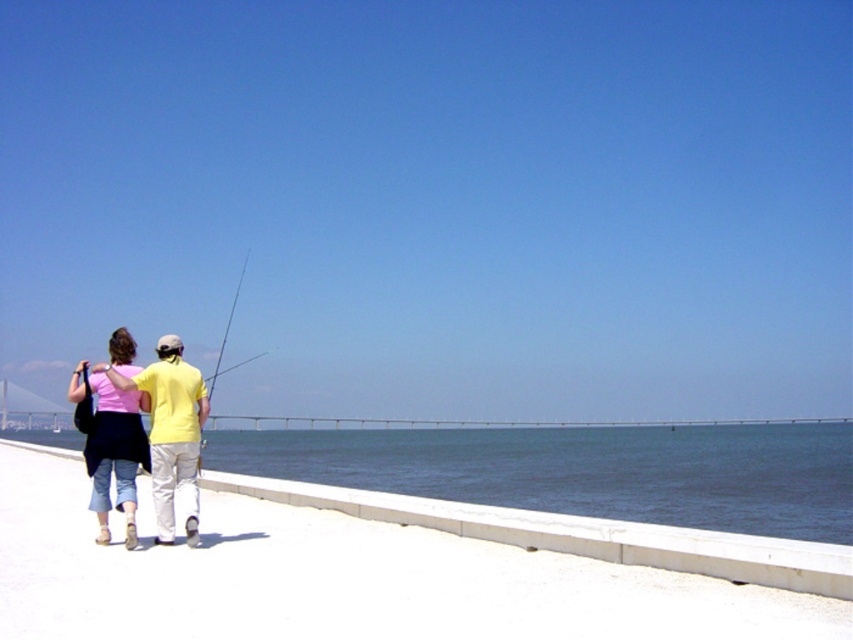
Question: Which is nearer to the matte yellow fishing pole at center?

Choices:
 (A) white concrete wall at lower center
 (B) pink fabric at center

Answer: (A)

Question: Does pink fabric at center lie behind matte yellow fishing pole at center?

Choices:
 (A) yes
 (B) no

Answer: (B)

Question: Considering the relative positions of pink fabric at center and matte yellow fishing pole at center in the image provided, where is pink fabric at center located with respect to matte yellow fishing pole at center?

Choices:
 (A) above
 (B) below

Answer: (A)

Question: Which is farther from the pink fabric at center?

Choices:
 (A) white concrete wall at lower center
 (B) matte yellow fishing pole at center

Answer: (B)

Question: Is white concrete wall at lower center bigger than pink fabric at center?

Choices:
 (A) no
 (B) yes

Answer: (B)

Question: Which of these objects is positioned farthest from the white concrete wall at lower center?

Choices:
 (A) matte yellow fishing pole at center
 (B) pink fabric at center

Answer: (A)